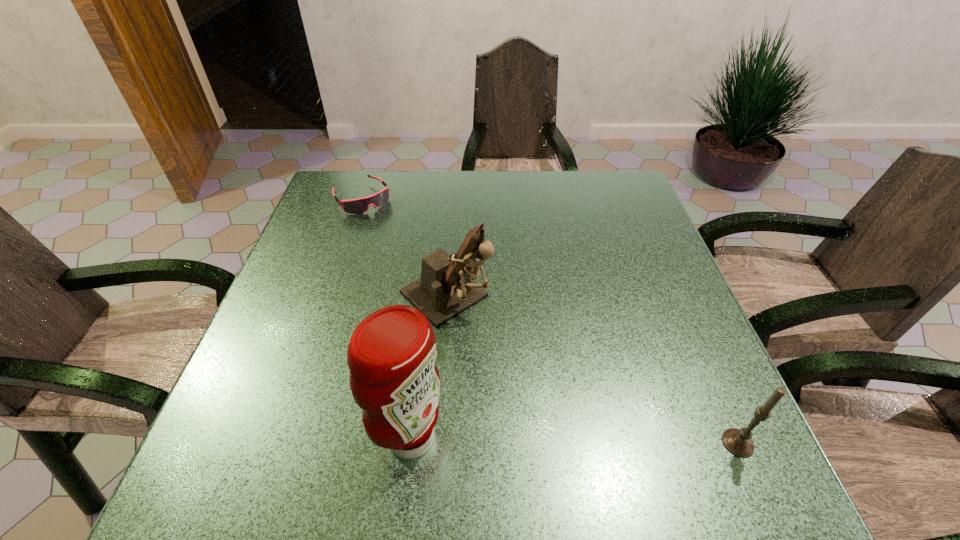
Where is `vacant space on the desktop that is between the condiment and the candle and is positioned on the front-facing side of the figurine`? The width and height of the screenshot is (960, 540). vacant space on the desktop that is between the condiment and the candle and is positioned on the front-facing side of the figurine is located at coordinates (603, 441).

Locate an element on the screen. vacant space on the desktop that is between the condiment and the third tallest object and is positioned on the front-facing side of the farthest object is located at coordinates (548, 440).